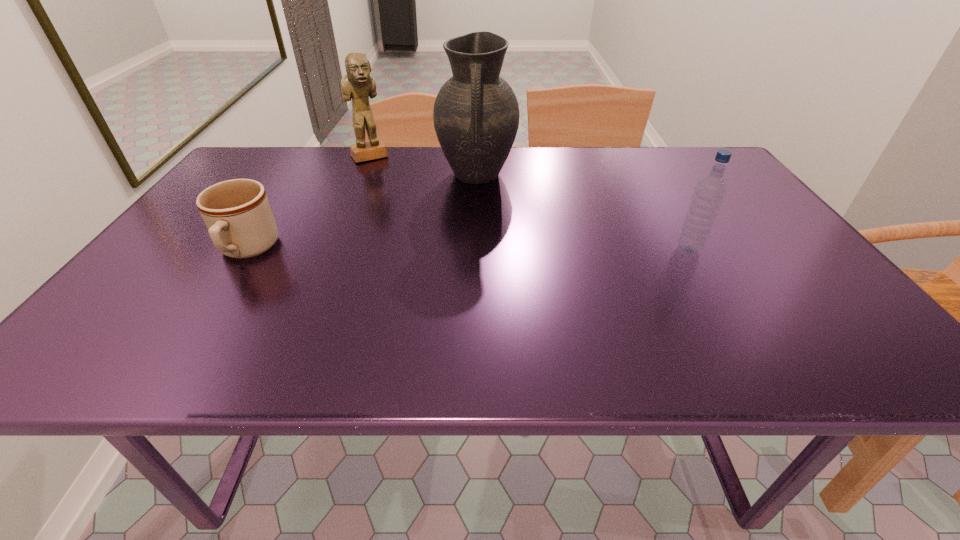
You are a GUI agent. You are given a task and a screenshot of the screen. Output one action in this format:
    pyautogui.click(x=<x>, y=<y>)
    Task: Click on the vacant area situated 0.270m on the side of the tallest object with the handle
    This screenshot has height=540, width=960.
    Given the screenshot: What is the action you would take?
    pyautogui.click(x=475, y=262)

Locate an element on the screen. The width and height of the screenshot is (960, 540). vacant space situated on the side of the tallest object with the handle is located at coordinates (476, 213).

At what (x,y) coordinates should I click in order to perform the action: click on blank space located 0.130m on the side of the tallest object with the handle. Please return your answer as a coordinate pair (x, y). Looking at the image, I should click on (476, 226).

Where is `vacant space located 0.100m on the front-facing side of the third shortest object`? This screenshot has width=960, height=540. vacant space located 0.100m on the front-facing side of the third shortest object is located at coordinates (387, 177).

Locate an element on the screen. The height and width of the screenshot is (540, 960). free space located on the front-facing side of the third shortest object is located at coordinates (401, 194).

You are a GUI agent. You are given a task and a screenshot of the screen. Output one action in this format:
    pyautogui.click(x=<x>, y=<y>)
    Task: Click on the free space located on the front-facing side of the third shortest object
    The image size is (960, 540).
    Given the screenshot: What is the action you would take?
    pyautogui.click(x=424, y=224)

Identify the location of pitcher present at the far edge. 476,114.

You are a GUI agent. You are given a task and a screenshot of the screen. Output one action in this format:
    pyautogui.click(x=<x>, y=<y>)
    Task: Click on the figurine at the far edge
    
    Given the screenshot: What is the action you would take?
    pyautogui.click(x=358, y=84)

You are a GUI agent. You are given a task and a screenshot of the screen. Output one action in this format:
    pyautogui.click(x=<x>, y=<y>)
    Task: Click on the object that is at the left edge
    This screenshot has width=960, height=540.
    Given the screenshot: What is the action you would take?
    pyautogui.click(x=237, y=213)

Identify the location of vacant space at the far edge of the desktop. (348, 183).